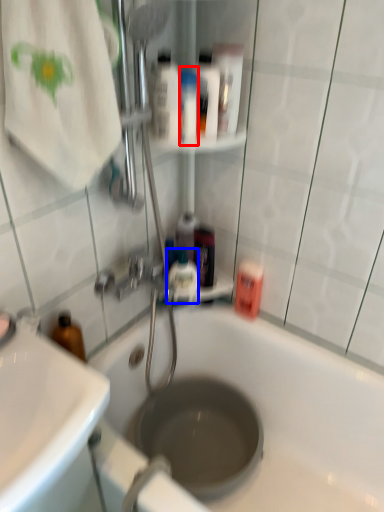
Question: Which object appears farthest to the camera in this image, toiletry (highlighted by a red box) or mouthwash (highlighted by a blue box)?

Choices:
 (A) toiletry
 (B) mouthwash

Answer: (B)